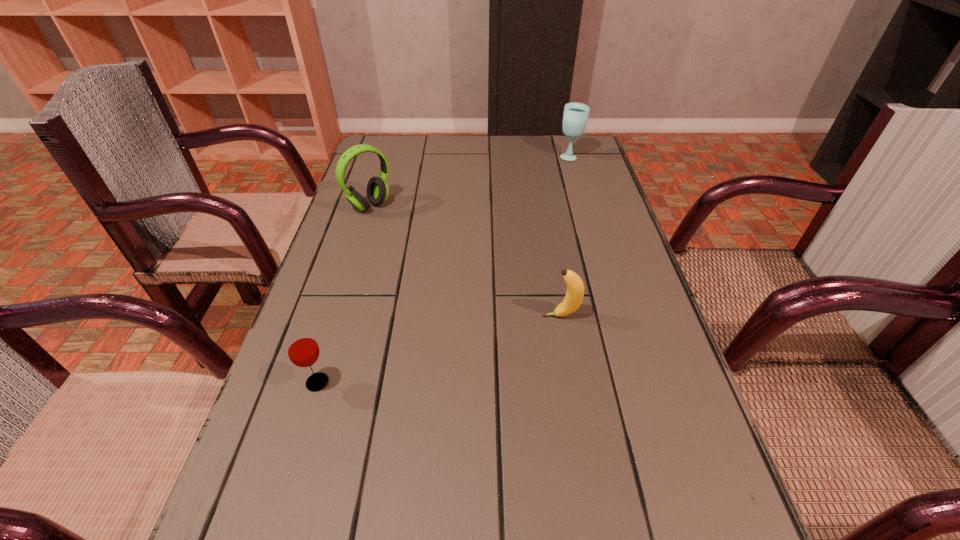
Find the location of `vacant area situated from the stem of the third object from left to right`. vacant area situated from the stem of the third object from left to right is located at coordinates (382, 316).

Locate an element on the screen. The width and height of the screenshot is (960, 540). vacant space situated from the stem of the third object from left to right is located at coordinates (509, 316).

Where is `vacant space located 0.080m on the right of the shorter glass`? vacant space located 0.080m on the right of the shorter glass is located at coordinates (375, 382).

Where is `object that is at the far edge`? Image resolution: width=960 pixels, height=540 pixels. object that is at the far edge is located at coordinates (575, 117).

The image size is (960, 540). I want to click on headset that is at the left edge, so click(x=377, y=188).

You are a GUI agent. You are given a task and a screenshot of the screen. Output one action in this format:
    pyautogui.click(x=<x>, y=<y>)
    Task: Click on the glass present at the left edge
    This screenshot has width=960, height=540.
    Given the screenshot: What is the action you would take?
    pyautogui.click(x=302, y=348)

You are a GUI agent. You are given a task and a screenshot of the screen. Output one action in this format:
    pyautogui.click(x=<x>, y=<y>)
    Task: Click on the object that is at the right edge
    The width and height of the screenshot is (960, 540).
    Given the screenshot: What is the action you would take?
    pyautogui.click(x=575, y=117)

I want to click on object situated at the far right corner, so click(x=575, y=117).

Where is `vacant space at the far edge`? The image size is (960, 540). vacant space at the far edge is located at coordinates (511, 154).

This screenshot has height=540, width=960. I want to click on free region at the left edge, so click(x=291, y=368).